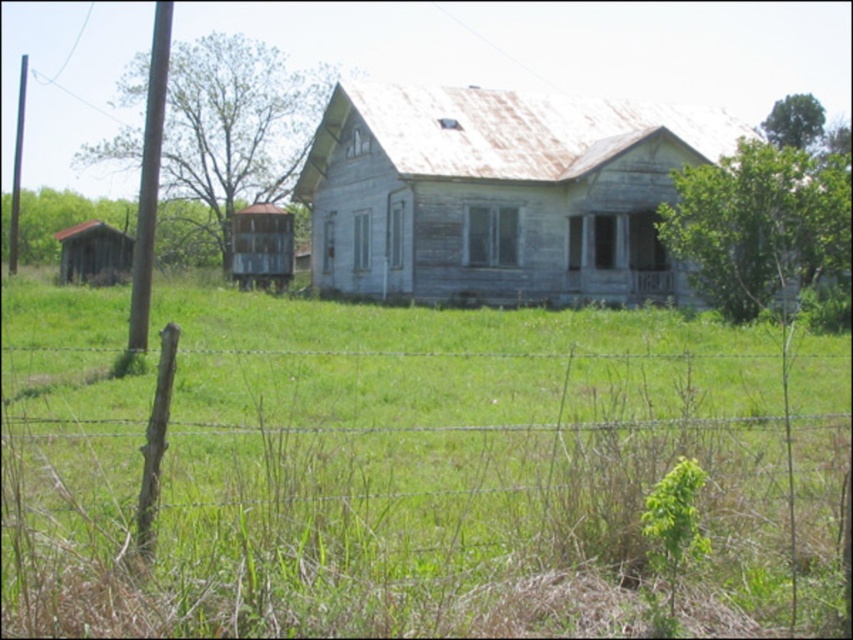
Which is in front, point (514, 413) or point (650, 541)?

Point (650, 541) is more forward.

Who is taller, barbed wire fence at lower left or green leafy plant at lower right?

Standing taller between the two is barbed wire fence at lower left.

I want to click on barbed wire fence at lower left, so click(x=419, y=484).

Locate an element on the screen. This screenshot has height=640, width=853. barbed wire fence at lower left is located at coordinates (419, 484).